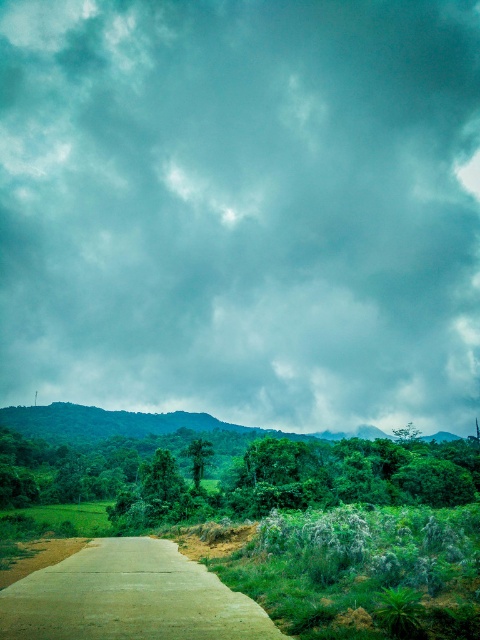
Which is above, gray cloudy sky at upper center or green leafy trees at center?

gray cloudy sky at upper center is higher up.

Between point (379, 209) and point (120, 451), which one is positioned in front?

Point (120, 451) is in front.

Is point (219, 113) positioned before point (24, 444)?

No, (219, 113) is behind (24, 444).

This screenshot has width=480, height=640. What are the coordinates of `gray cloudy sky at upper center` in the screenshot? It's located at (242, 209).

Is concrete road at center to the left of green leafy mountain at center from the viewer's perspective?

Correct, you'll find concrete road at center to the left of green leafy mountain at center.

Measure the distance from concrete road at center to green leafy mountain at center.

265.05 meters

Locate an element on the screen. concrete road at center is located at coordinates (129, 596).

Can you confirm if green leafy trees at center is positioned above concrete road at center?

No.

Can you confirm if green leafy trees at center is smaller than concrete road at center?

No, green leafy trees at center is not smaller than concrete road at center.

Does point (204, 452) come closer to viewer compared to point (86, 572)?

That is False.

The image size is (480, 640). Find the location of `green leafy trees at center`. green leafy trees at center is located at coordinates (235, 476).